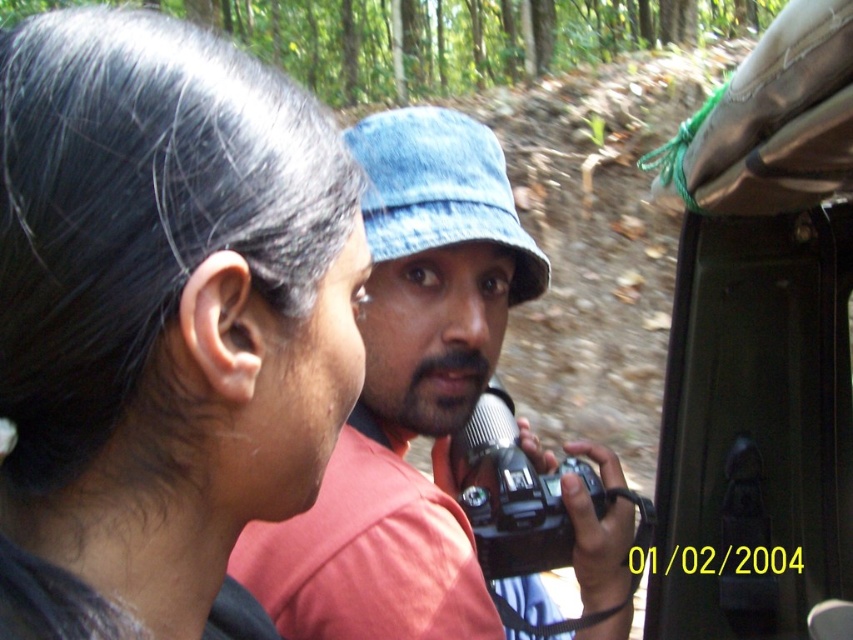
Who is taller, denim hat at center or denim blue hat at center?

denim hat at center is taller.

Where is `denim hat at center`? The width and height of the screenshot is (853, 640). denim hat at center is located at coordinates (410, 400).

Where is `black hair at upper left`? The width and height of the screenshot is (853, 640). black hair at upper left is located at coordinates (160, 317).

Can you confirm if black hair at upper left is wider than denim hat at center?

Incorrect, black hair at upper left's width does not surpass denim hat at center's.

Which is in front, point (277, 296) or point (387, 608)?

Point (277, 296) is in front.

This screenshot has height=640, width=853. I want to click on black hair at upper left, so click(x=160, y=317).

Which is behind, point (189, 556) or point (457, 228)?

Positioned behind is point (457, 228).

Is point (97, 500) more distant than point (445, 164)?

No.

Find the location of a particular element. black hair at upper left is located at coordinates (160, 317).